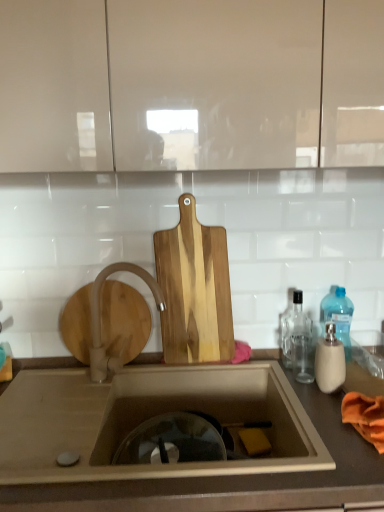
Question: Based on their sizes in the image, would you say white matte faucet at sink left is bigger or smaller than transparent glass bottle at right, which ranks as the 2th bottle in back-to-front order?

Choices:
 (A) big
 (B) small

Answer: (A)

Question: Considering the positions of point (94, 343) and point (296, 314), is point (94, 343) closer or farther from the camera than point (296, 314)?

Choices:
 (A) farther
 (B) closer

Answer: (B)

Question: Which is farther from the natural wood cutting board at center?

Choices:
 (A) blue translucent bottle at right, the 1th bottle in the back-to-front sequence
 (B) brown matte countertop at lower center
 (C) beige matte soap dispenser at right, arranged as the first bottle when viewed from the front
 (D) white matte faucet at sink left
 (E) transparent glass bottle at right, the 2th bottle when ordered from front to back

Answer: (B)

Question: Which of these objects is positioned closest to the beige matte soap dispenser at right, marked as the third bottle in a back-to-front arrangement?

Choices:
 (A) matte white cabinet at upper center
 (B) blue translucent bottle at right, the 1th bottle in the back-to-front sequence
 (C) natural wood cutting board at center
 (D) brown matte countertop at lower center
 (E) white matte faucet at sink left

Answer: (B)